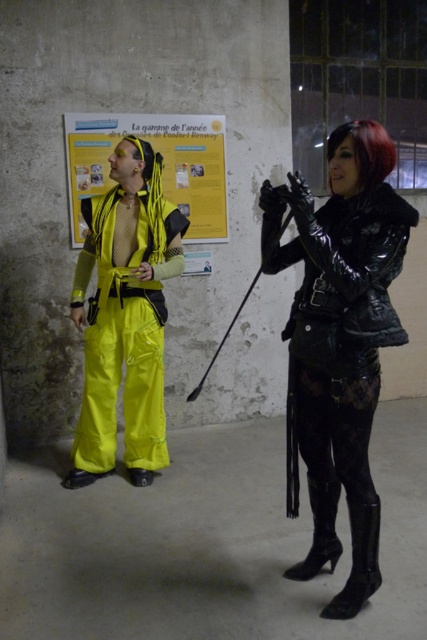
You are an interior designer assessing the placement of items in this room. You notice the glossy black leather jacket at right and the yellow paper poster at upper center. Which object is taller?

The glossy black leather jacket at right is taller than the yellow paper poster at upper center according to the description.

You are a fashion designer observing the two outfits in the scene. Which object is taller between the neon yellow fabric pants at left and the black patent leather boot at lower right?

The neon yellow fabric pants at left is much taller than the black patent leather boot at lower right according to the description.

You are trying to determine the spatial relationship between the neon yellow fabric pants at left and the black patent leather boot at lower right. Based on the scene, which object is closer to the viewer?

The black patent leather boot at lower right is behind the neon yellow fabric pants at left, so the neon yellow fabric pants at left is closer to the viewer.